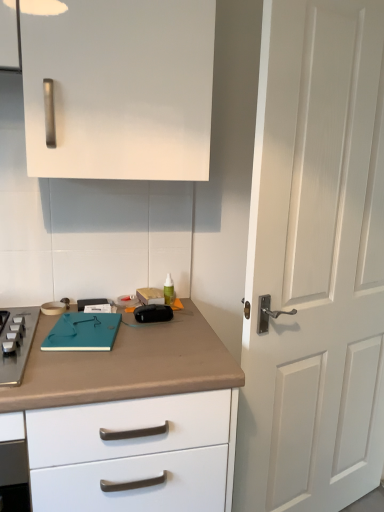
Locate an element on the screen. This screenshot has height=512, width=384. free space above teal matte notebook at center (from a real-world perspective) is located at coordinates (91, 325).